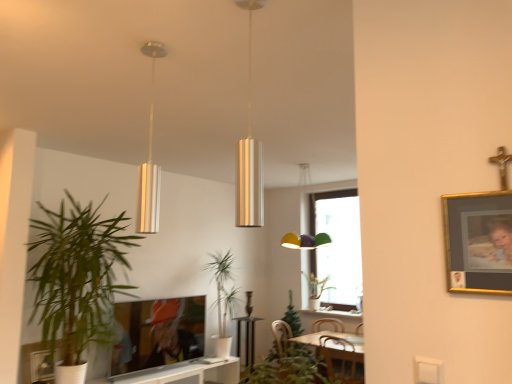
Question: Can you confirm if green leafy plant at center, acting as the 2th houseplant starting from the back, is bigger than metallic cylinder at center, positioned as the second lamp in left-to-right order?

Choices:
 (A) no
 (B) yes

Answer: (B)

Question: Does green leafy plant at center, which is the third houseplant in right-to-left order, appear on the left side of metallic cylinder at center, the second lamp when ordered from back to front?

Choices:
 (A) yes
 (B) no

Answer: (A)

Question: Can metallic cylinder at center, the first lamp positioned from the front, be found inside green leafy plant at center, acting as the 2th houseplant starting from the back?

Choices:
 (A) yes
 (B) no

Answer: (B)

Question: Is green leafy plant at center, which is the third houseplant in right-to-left order, behind metallic cylinder at center, positioned as the second lamp in left-to-right order?

Choices:
 (A) yes
 (B) no

Answer: (A)

Question: From the image's perspective, is green leafy plant at center, the second houseplant in the left-to-right sequence, located beneath metallic cylinder at center, the first lamp positioned from the front?

Choices:
 (A) no
 (B) yes

Answer: (B)

Question: Is green leafy plant at center, the second houseplant in the left-to-right sequence, at the right side of metallic cylinder at center, the second lamp when ordered from back to front?

Choices:
 (A) no
 (B) yes

Answer: (A)

Question: Can green leafy plant at center, which is the third houseplant in right-to-left order, be found inside metallic cylinder at center, the first lamp positioned from the right?

Choices:
 (A) no
 (B) yes

Answer: (A)

Question: From the image's perspective, does metallic cylinder at center, positioned as the second lamp in left-to-right order, appear higher than green leafy plant at center, acting as the 2th houseplant starting from the back?

Choices:
 (A) yes
 (B) no

Answer: (A)

Question: Is metallic cylinder at center, positioned as the second lamp in left-to-right order, smaller than green leafy plant at center, which is the third houseplant in right-to-left order?

Choices:
 (A) no
 (B) yes

Answer: (B)

Question: Is metallic cylinder at center, the second lamp when ordered from back to front, further to the viewer compared to green leafy plant at center, the second houseplant in the left-to-right sequence?

Choices:
 (A) no
 (B) yes

Answer: (A)

Question: Is metallic cylinder at center, the second lamp when ordered from back to front, not within green leafy plant at center, acting as the 2th houseplant starting from the back?

Choices:
 (A) yes
 (B) no

Answer: (A)

Question: Is metallic cylinder at center, the first lamp positioned from the front, thinner than green leafy plant at center, which is the third houseplant in right-to-left order?

Choices:
 (A) yes
 (B) no

Answer: (A)

Question: From a real-world perspective, is wooden swivel chair at lower center positioned over green leafy plant at left, the 1th houseplant viewed from the left, based on gravity?

Choices:
 (A) no
 (B) yes

Answer: (A)